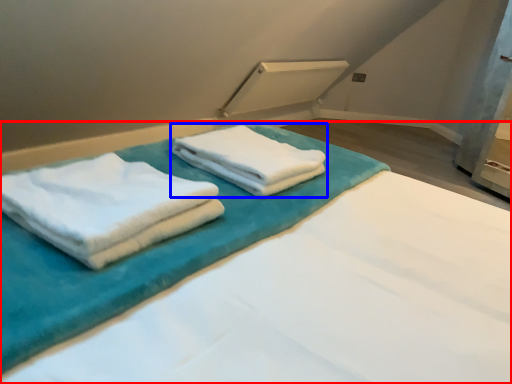
Question: Which point is closer to the camera, bed (highlighted by a red box) or towel (highlighted by a blue box)?

Choices:
 (A) bed
 (B) towel

Answer: (A)